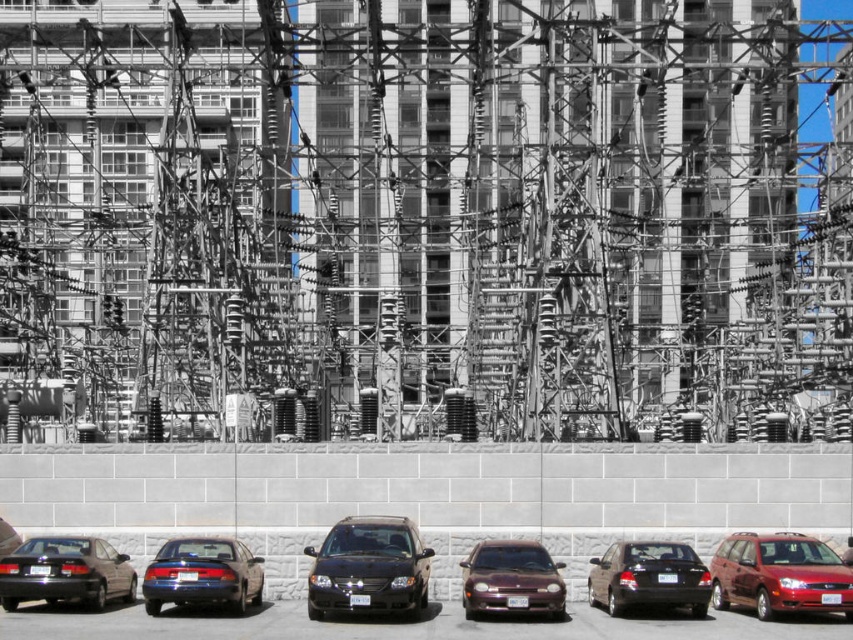
You are a delivery driver who needs to park your vehicle in this parking area. You see the shiny black van at center and the shiny blue sedan at lower left. Which vehicle is closer to the right side of the parking area?

The shiny black van at center is positioned on the right side of the shiny blue sedan at lower left, so it is closer to the right side of the parking area.

You are a delivery person needing to park your 5.5 meter long truck between the shiny black van at center and the shiny blue sedan at lower left. Can you fit your truck in the space between them without moving either vehicle?

The space between the shiny black van at center and the shiny blue sedan at lower left is 6.06 meters. Since your truck is 5.5 meters long, it can fit in the space between them without moving either vehicle.

Based on the photo, you are a parking attendant who needs to fit both the shiny blue sedan at lower left and the metallic maroon sedan at center into a parking spot that is 2.5 meters wide. Based on their widths, can both vehicles fit side by side in the spot?

The shiny blue sedan at lower left is wider than the metallic maroon sedan at center. Since the parking spot is 2.5 meters wide, and the combined width of both vehicles exceeds this measurement, they cannot fit side by side in the spot.